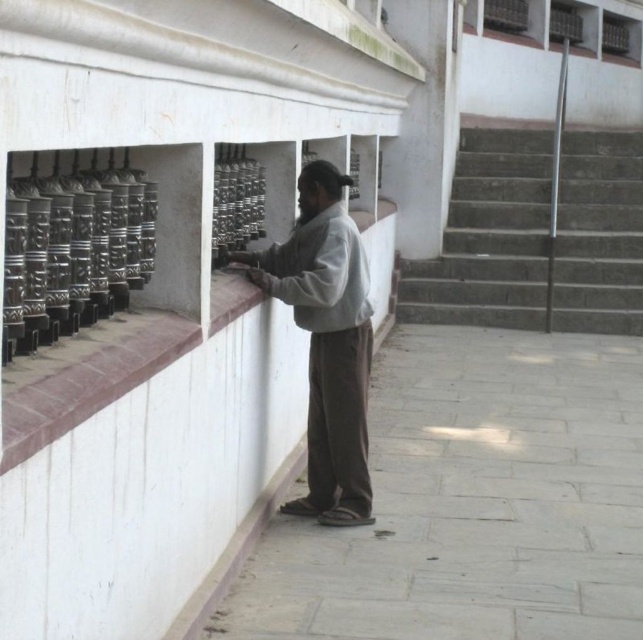
In the scene shown: You are standing at the point labeled point (356, 280) and want to move to the point labeled point (536, 220). Which direction should you face to walk towards the second point?

To move from point (356, 280) to point (536, 220), you should face upwards and to the left since point (536, 220) is located behind point (356, 280).

You are standing at the base of the concrete stairs at right and want to reach the gray cotton shirt at center. Can you step onto the stairs to get closer to the shirt?

The concrete stairs at right is taller than gray cotton shirt at center, so stepping onto the stairs would place you higher than the shirt, making it harder to reach.